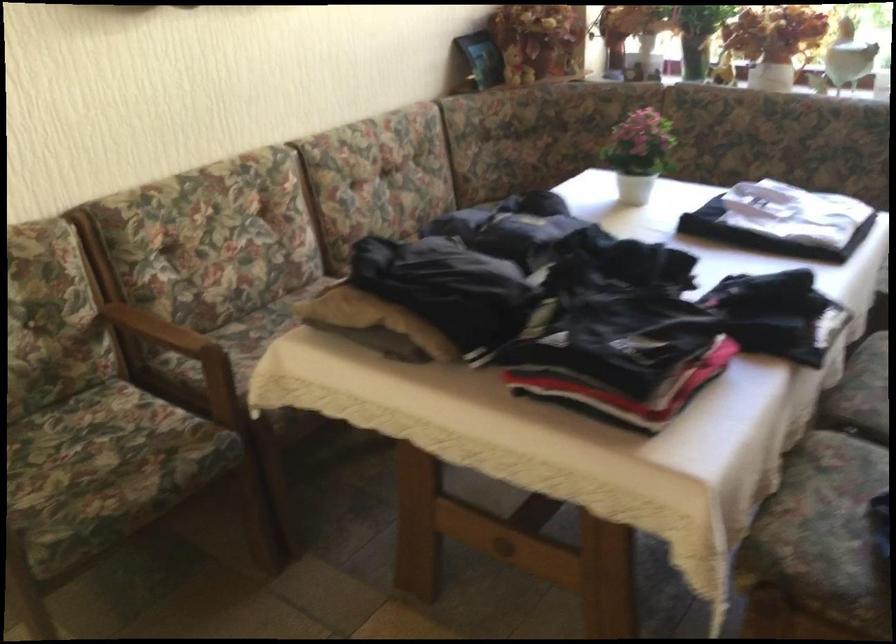
Describe the element at coordinates (158, 328) in the screenshot. The width and height of the screenshot is (896, 644). I see `a wooden chair armrest` at that location.